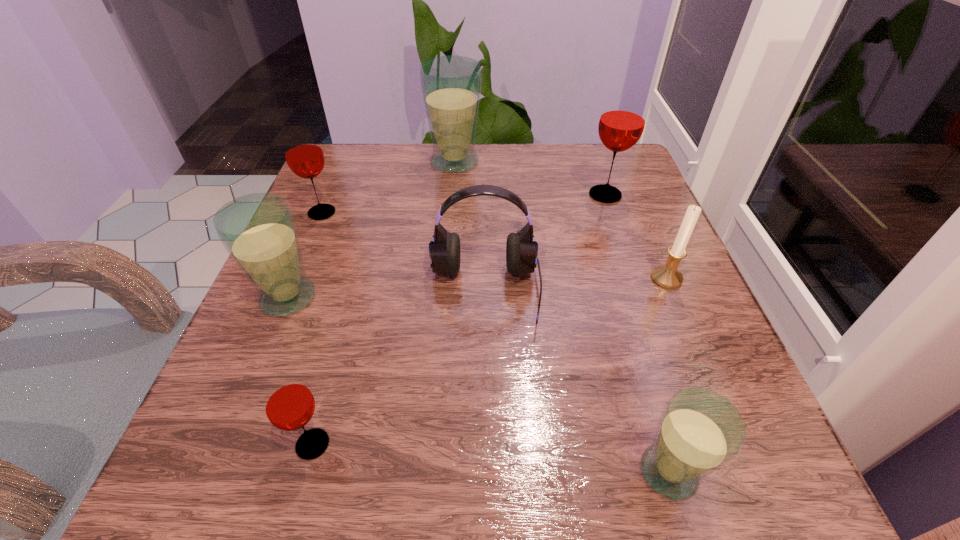
Find the location of a particular element. The image size is (960, 540). vacant area between the third glass from right to left and the leftmost red glass is located at coordinates (388, 187).

This screenshot has width=960, height=540. Identify the location of free space between the rightmost red glass and the candle holder. (636, 237).

Where is `object that is the closest to the candle holder`? The height and width of the screenshot is (540, 960). object that is the closest to the candle holder is located at coordinates (623, 117).

At what (x,y) coordinates should I click in order to perform the action: click on the closest object to the rightmost red glass. Please return your answer as a coordinate pair (x, y). Looking at the image, I should click on (667, 276).

Image resolution: width=960 pixels, height=540 pixels. What are the coordinates of `glass that stands as the third closest to the candle holder` in the screenshot? It's located at (451, 85).

Identify which glass is located as the third nearest to the smallest red glass. Please provide its 2D coordinates. Your answer should be formatted as a tuple, i.e. [(x, y)], where the tuple contains the x and y coordinates of a point satisfying the conditions above.

[(303, 153)]

Identify which blue glass is the nearest to the third glass from left to right. Please provide its 2D coordinates. Your answer should be formatted as a tuple, i.e. [(x, y)], where the tuple contains the x and y coordinates of a point satisfying the conditions above.

[(258, 230)]

At what (x,y) coordinates should I click in order to perform the action: click on blue glass object that ranks as the second closest to the second red glass from right to left. Please return your answer as a coordinate pair (x, y). The height and width of the screenshot is (540, 960). Looking at the image, I should click on (699, 431).

Image resolution: width=960 pixels, height=540 pixels. What are the coordinates of `red glass that stands as the second closest to the nearest red glass` in the screenshot? It's located at (623, 117).

The image size is (960, 540). In order to click on red glass that is the second closest to the fourth glass from left to right in this screenshot , I will do `click(623, 117)`.